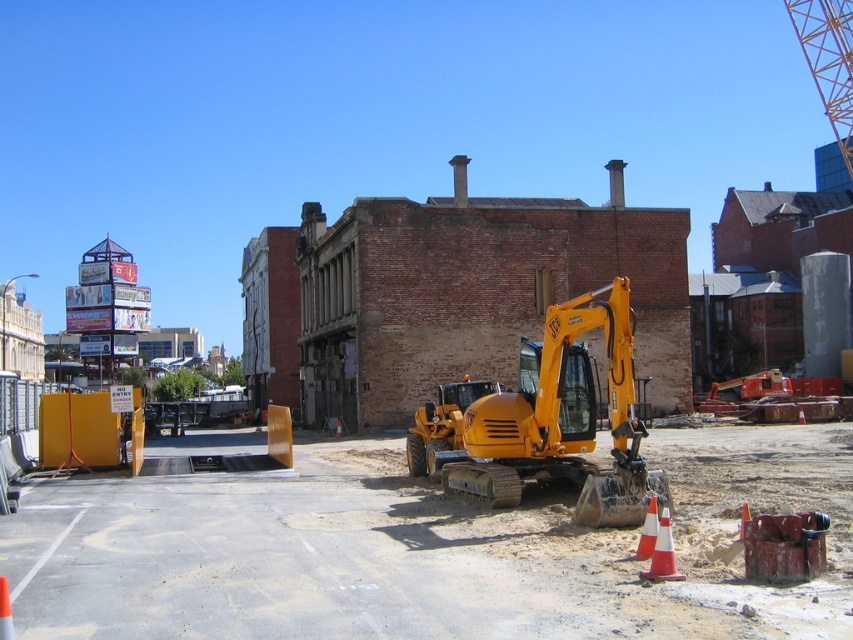
Who is lower down, yellow rubber excavator at center or orange plastic cone at lower right?

orange plastic cone at lower right is lower down.

Which is behind, point (622, 337) or point (656, 545)?

Point (622, 337)

Between point (625, 397) and point (659, 532), which one is positioned behind?

The point (625, 397) is more distant.

Identify the location of yellow rubber excavator at center. (553, 420).

Does point (830, 17) come behind point (642, 573)?

Yes, it is.

Which is below, yellow metallic crane at upper right or orange plastic cone at lower right?

Positioned lower is orange plastic cone at lower right.

Is point (848, 157) in front of point (651, 576)?

No, (848, 157) is behind (651, 576).

At what (x,y) coordinates should I click in order to perform the action: click on yellow metallic crane at upper right. Please return your answer as a coordinate pair (x, y). The image size is (853, 640). Looking at the image, I should click on (828, 60).

Between point (660, 579) and point (4, 627), which one is positioned behind?

Point (660, 579)

Does orange plastic cone at lower right have a lesser height compared to orange traffic cone at lower left?

No.

Consider the image. Who is more forward, (x=659, y=540) or (x=1, y=605)?

Point (x=1, y=605)

The height and width of the screenshot is (640, 853). I want to click on orange plastic cone at lower right, so click(x=663, y=554).